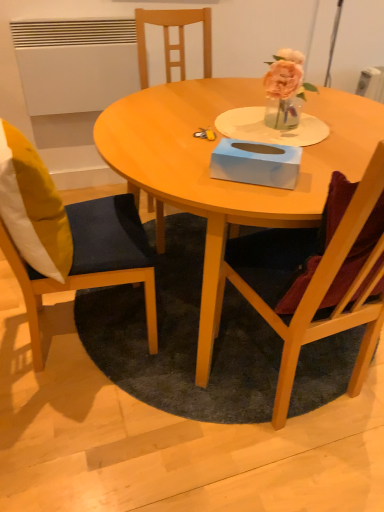
Question: Is light blue cardboard tissue box at center oriented towards wooden table at center?

Choices:
 (A) yes
 (B) no

Answer: (B)

Question: Is light blue cardboard tissue box at center to the left of wooden table at center from the viewer's perspective?

Choices:
 (A) no
 (B) yes

Answer: (B)

Question: Is light blue cardboard tissue box at center further to the viewer compared to wooden table at center?

Choices:
 (A) yes
 (B) no

Answer: (A)

Question: Is the depth of light blue cardboard tissue box at center less than that of wooden table at center?

Choices:
 (A) yes
 (B) no

Answer: (B)

Question: Does light blue cardboard tissue box at center have a smaller size compared to wooden table at center?

Choices:
 (A) no
 (B) yes

Answer: (B)

Question: From a real-world perspective, is wooden table at center physically located above or below yellow fabric pillow at left?

Choices:
 (A) below
 (B) above

Answer: (A)

Question: Is point (231, 201) closer or farther from the camera than point (56, 202)?

Choices:
 (A) farther
 (B) closer

Answer: (B)

Question: Looking at their shapes, would you say wooden table at center is wider or thinner than yellow fabric pillow at left?

Choices:
 (A) wide
 (B) thin

Answer: (A)

Question: Considering the relative positions of wooden table at center and yellow fabric pillow at left in the image provided, is wooden table at center to the left or to the right of yellow fabric pillow at left?

Choices:
 (A) left
 (B) right

Answer: (B)

Question: Relative to wooden chair at right, arranged as the 2th chair when viewed from the left, is dark gray carpet at center in front or behind?

Choices:
 (A) behind
 (B) front

Answer: (A)

Question: Would you say dark gray carpet at center is inside or outside wooden chair at right, arranged as the 2th chair when viewed from the left?

Choices:
 (A) inside
 (B) outside

Answer: (B)

Question: From the image's perspective, relative to wooden chair at right, arranged as the 2th chair when viewed from the left, is dark gray carpet at center above or below?

Choices:
 (A) above
 (B) below

Answer: (B)

Question: Is dark gray carpet at center taller or shorter than wooden chair at right, arranged as the 2th chair when viewed from the left?

Choices:
 (A) tall
 (B) short

Answer: (B)

Question: Relative to dark gray carpet at center, is wooden chair at left, which is counted as the 2th chair, starting from the right, in front or behind?

Choices:
 (A) front
 (B) behind

Answer: (A)

Question: Considering the positions of wooden chair at left, the first chair in the left-to-right sequence, and dark gray carpet at center in the image, is wooden chair at left, the first chair in the left-to-right sequence, wider or thinner than dark gray carpet at center?

Choices:
 (A) wide
 (B) thin

Answer: (B)